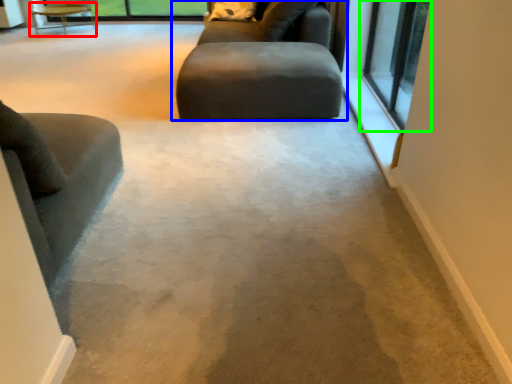
Question: Estimate the real-world distances between objects in this image. Which object is closer to table (highlighted by a red box), studio couch (highlighted by a blue box) or window (highlighted by a green box)?

Choices:
 (A) studio couch
 (B) window

Answer: (A)